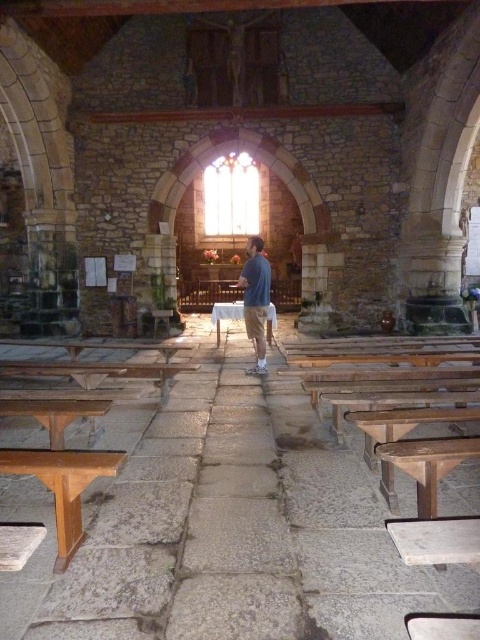
This screenshot has width=480, height=640. Identify the location of blue cotton shirt at center. click(x=255, y=300).

Is blue cotton shirt at center above wooden bench at center?

Actually, blue cotton shirt at center is below wooden bench at center.

You are a GUI agent. You are given a task and a screenshot of the screen. Output one action in this format:
    pyautogui.click(x=<x>, y=<y>)
    Task: Click on the blue cotton shirt at center
    This screenshot has width=480, height=640.
    Given the screenshot: What is the action you would take?
    pyautogui.click(x=255, y=300)

Image resolution: width=480 pixels, height=640 pixels. What are the coordinates of `blue cotton shirt at center` in the screenshot? It's located at (255, 300).

Where is `wooden bench at lower left`? This screenshot has height=640, width=480. wooden bench at lower left is located at coordinates (63, 484).

Who is lower down, wooden bench at lower left or wooden bench at center?

wooden bench at lower left is below.

Which is behind, point (93, 460) or point (155, 333)?

The point (155, 333) is behind.

Where is `wooden bench at lower left`? This screenshot has height=640, width=480. wooden bench at lower left is located at coordinates coord(63,484).

From the picture: Is wooden bench at lower left below blue cotton shirt at center?

Indeed, wooden bench at lower left is positioned under blue cotton shirt at center.

Can you confirm if wooden bench at lower left is wider than blue cotton shirt at center?

Indeed, wooden bench at lower left has a greater width compared to blue cotton shirt at center.

Locate an element on the screen. The image size is (480, 640). wooden bench at lower left is located at coordinates (63, 484).